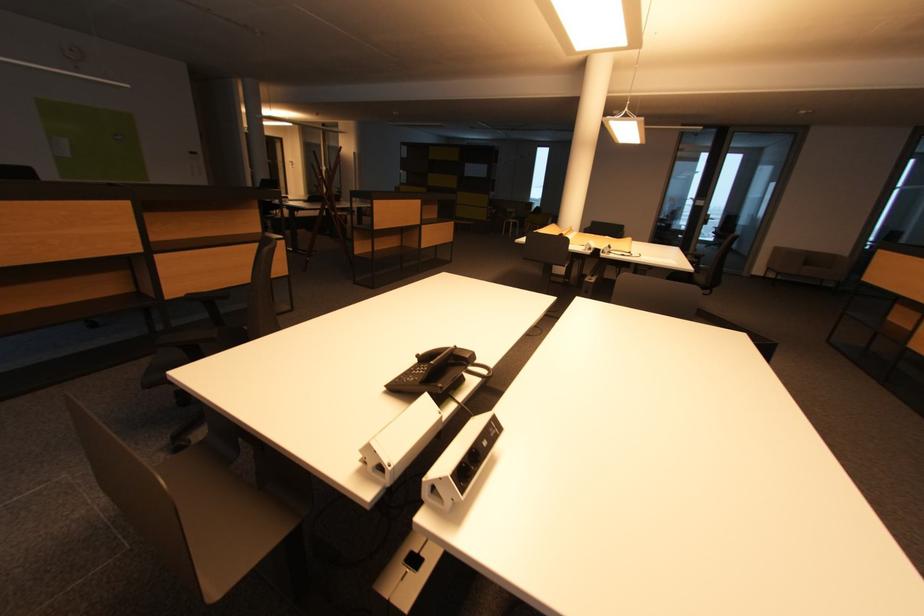
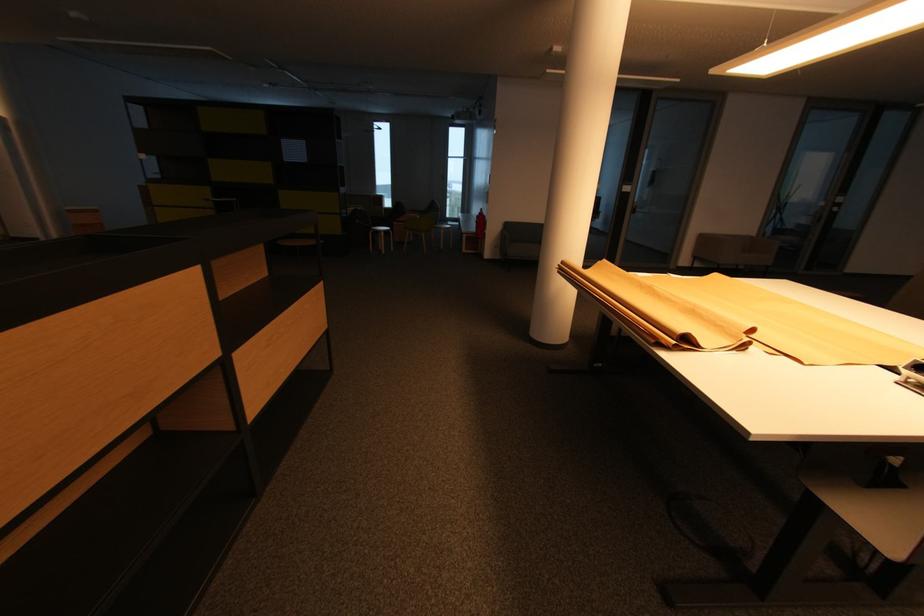
Question: The images are taken continuously from a first-person perspective. In which direction are you moving?

Choices:
 (A) Left
 (B) Right
 (C) Forward
 (D) Backward

Answer: (C)